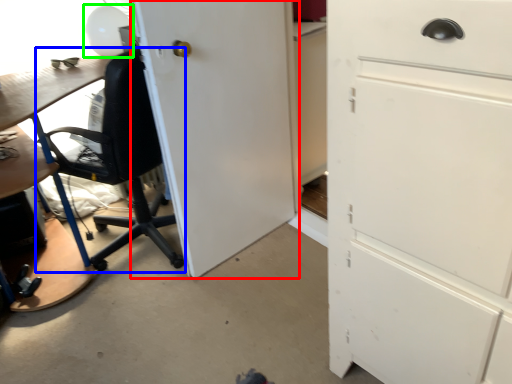
Question: Based on their relative distances, which object is nearer to door (highlighted by a red box)? Choose from chair (highlighted by a blue box) and table lamp (highlighted by a green box).

Choices:
 (A) chair
 (B) table lamp

Answer: (A)